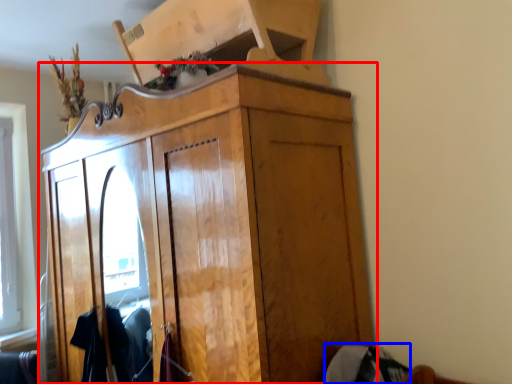
Question: Which object appears farthest to the camera in this image, cupboard (highlighted by a red box) or clothing (highlighted by a blue box)?

Choices:
 (A) cupboard
 (B) clothing

Answer: (B)